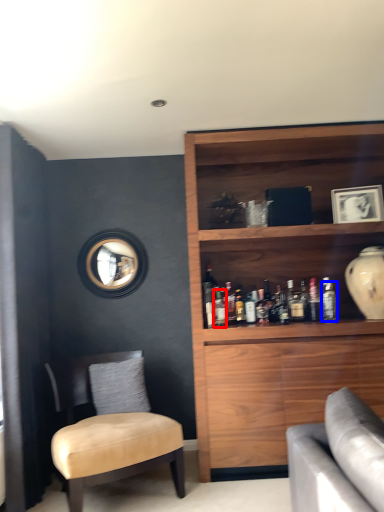
Question: Which point is closer to the camera, bottle (highlighted by a red box) or bottle (highlighted by a blue box)?

Choices:
 (A) bottle
 (B) bottle

Answer: (A)